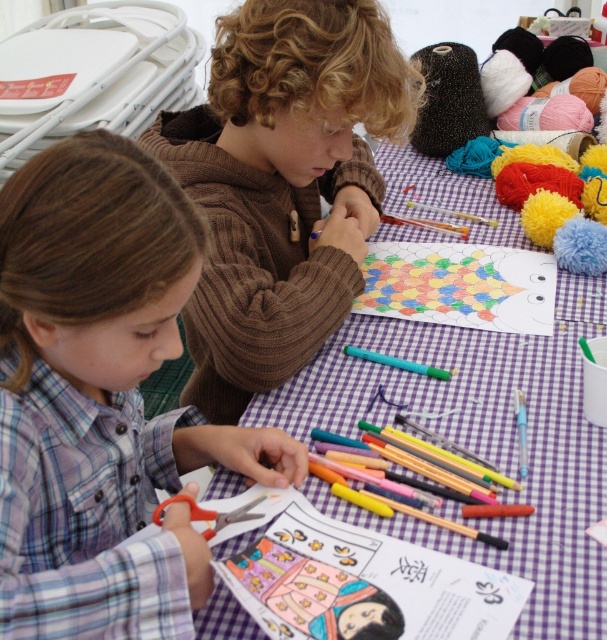
Question: Is plaid fabric shirt at center below orange plastic scissors at lower left?

Choices:
 (A) no
 (B) yes

Answer: (A)

Question: Does plaid fabric shirt at center appear under brown knitted sweater at upper center?

Choices:
 (A) no
 (B) yes

Answer: (B)

Question: Does purple checkered table at center have a greater width compared to orange plastic scissors at lower left?

Choices:
 (A) no
 (B) yes

Answer: (B)

Question: Which object appears farthest from the camera in this image?

Choices:
 (A) plaid fabric shirt at center
 (B) orange plastic scissors at lower left
 (C) brown knitted sweater at upper center
 (D) purple checkered table at center

Answer: (C)

Question: Which point is farther to the camera?

Choices:
 (A) orange plastic scissors at lower left
 (B) brown knitted sweater at upper center

Answer: (B)

Question: Based on their relative distances, which object is farther from the purple checkered table at center?

Choices:
 (A) brown knitted sweater at upper center
 (B) orange plastic scissors at lower left

Answer: (B)